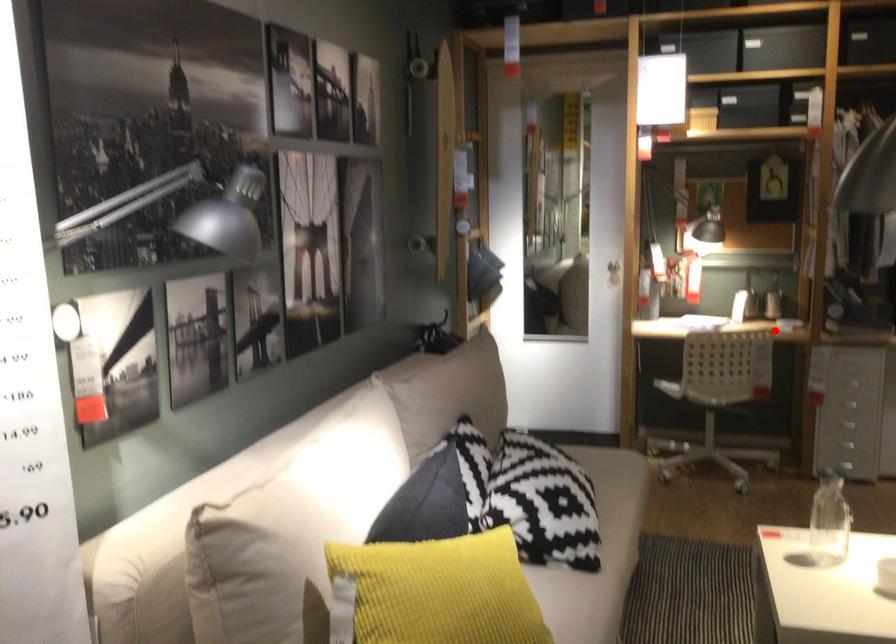
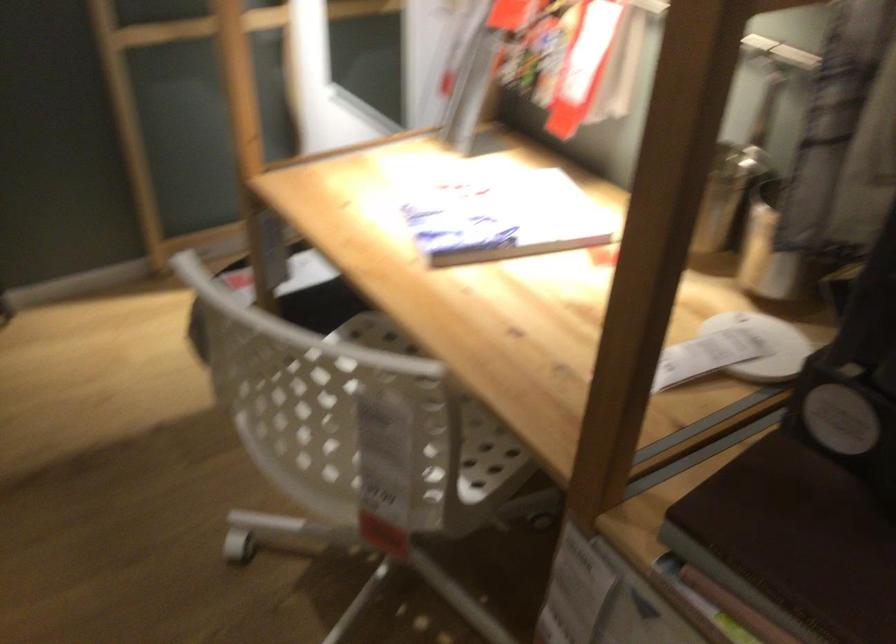
Question: I am providing you with two images of the same scene from different viewpoints. Given a red point in image1, look at the same physical point in image2. Is it:

Choices:
 (A) Closer to the viewpoint
 (B) Farther from the viewpoint

Answer: (A)